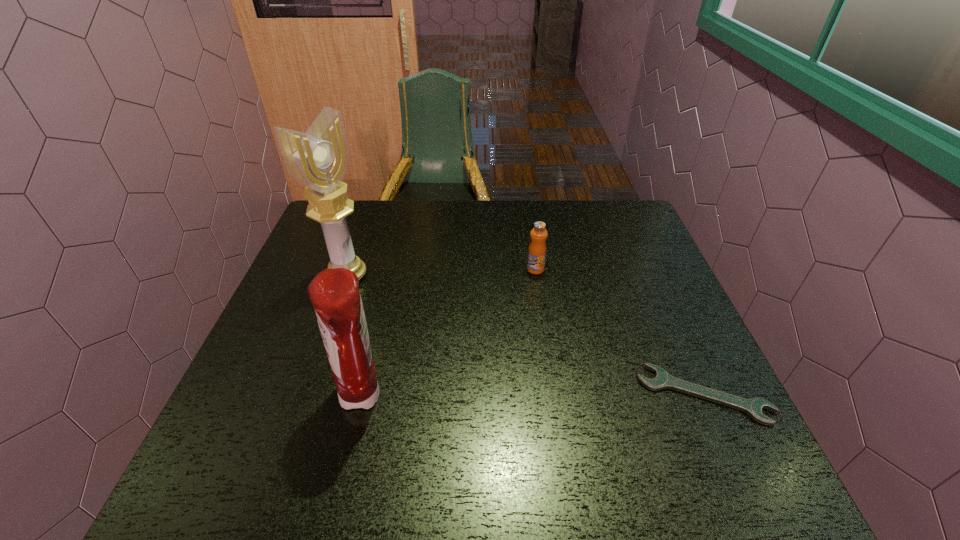
Where is `the second object from left to right`? This screenshot has width=960, height=540. the second object from left to right is located at coordinates (334, 294).

Find the location of a particular element. Image resolution: width=960 pixels, height=540 pixels. the third shortest object is located at coordinates (334, 294).

This screenshot has height=540, width=960. I want to click on the shortest object, so click(x=753, y=407).

At what (x,y) coordinates should I click in order to perform the action: click on the rightmost object. Please return your answer as a coordinate pair (x, y). The image size is (960, 540). Looking at the image, I should click on (753, 407).

Find the location of a particular element. This screenshot has height=540, width=960. the second object from right to left is located at coordinates (537, 249).

What are the coordinates of `the second shortest object` in the screenshot? It's located at (537, 249).

The height and width of the screenshot is (540, 960). I want to click on award, so click(318, 159).

Where is `the leftmost object`? the leftmost object is located at coordinates (318, 159).

Where is `free space located 0.340m on the right of the third shortest object`? This screenshot has width=960, height=540. free space located 0.340m on the right of the third shortest object is located at coordinates [x=547, y=396].

Where is `vacant position located 0.180m on the back of the rightmost object`? vacant position located 0.180m on the back of the rightmost object is located at coordinates (665, 309).